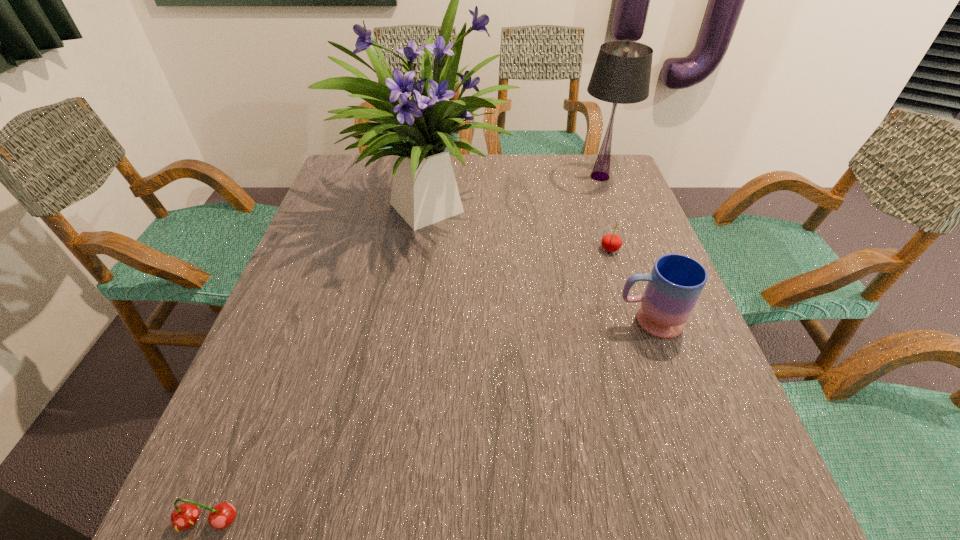
In the image, there is a desktop. What are the coordinates of `vacant region at the far right corner` in the screenshot? It's located at pos(622,190).

I want to click on free spot between the tallest object and the left cherry, so coord(320,361).

Find the location of a particular element. This screenshot has width=960, height=540. vacant area between the nearest object and the third tallest object is located at coordinates (428, 421).

At what (x,y) coordinates should I click in order to perform the action: click on vacant space in between the mug and the left cherry. Please return your answer as a coordinate pair (x, y). Looking at the image, I should click on (428, 421).

Locate an element on the screen. Image resolution: width=960 pixels, height=540 pixels. free area in between the fourth shortest object and the nearer cherry is located at coordinates (404, 349).

You are a GUI agent. You are given a task and a screenshot of the screen. Output one action in this format:
    pyautogui.click(x=<x>, y=<y>)
    Task: Click on the free space that is in between the flower arrangement and the right cherry
    
    Given the screenshot: What is the action you would take?
    pyautogui.click(x=520, y=225)

Locate an element on the screen. The height and width of the screenshot is (540, 960). vacant space that is in between the tallest object and the mug is located at coordinates (540, 261).

Where is `vacant space that's between the right cherry and the left cherry`? vacant space that's between the right cherry and the left cherry is located at coordinates (409, 386).

At what (x,y) coordinates should I click in order to perform the action: click on free space between the mug and the second tallest object. Please return your answer as a coordinate pair (x, y). Looking at the image, I should click on (624, 249).

I want to click on vacant point located between the farther cherry and the second tallest object, so click(605, 213).